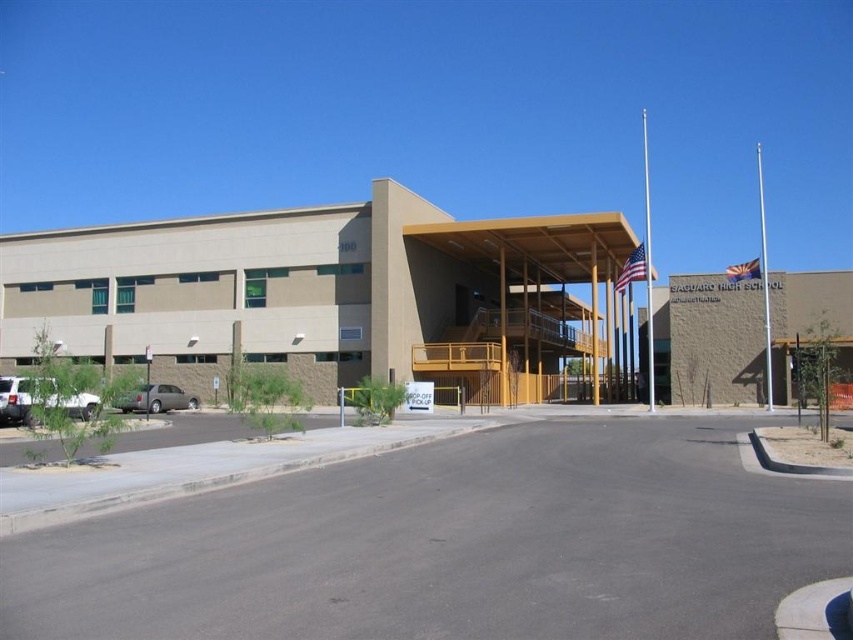
Does white matte truck at lower left come behind gray metallic sedan at lower left?

That is False.

Does white matte truck at lower left have a greater width compared to gray metallic sedan at lower left?

Yes.

Locate an element on the screen. Image resolution: width=853 pixels, height=640 pixels. white matte truck at lower left is located at coordinates (15, 401).